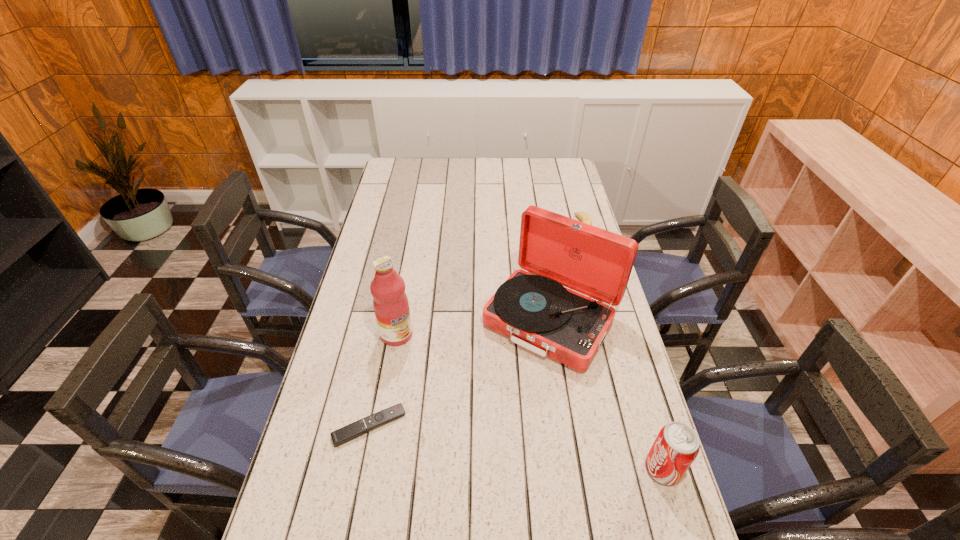
Find the location of a particular element. remote control is located at coordinates (349, 432).

Identify the location of the shortest object. The image size is (960, 540). (349, 432).

Identify the location of the third shortest object. (677, 445).

I want to click on soda can, so click(x=677, y=445).

Locate an element on the screen. This screenshot has height=540, width=960. phonograph_record is located at coordinates (532, 308).

Image resolution: width=960 pixels, height=540 pixels. In order to click on fruit juice in this screenshot , I will do `click(390, 302)`.

At what (x,y) coordinates should I click in order to perform the action: click on the fourth tallest object. Please return your answer as a coordinate pair (x, y). Looking at the image, I should click on (584, 217).

This screenshot has height=540, width=960. I want to click on the farthest object, so click(584, 217).

Find the location of a particular element. free space located 0.200m on the front of the remote control is located at coordinates pyautogui.click(x=348, y=536).

Identify the location of vacant space located on the back of the soda can. This screenshot has width=960, height=540. (634, 371).